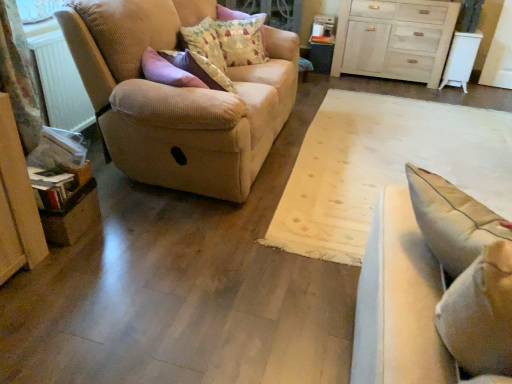
The width and height of the screenshot is (512, 384). Describe the element at coordinates (242, 40) in the screenshot. I see `patterned fabric pillow at upper center, marked as the first pillow in a back-to-front arrangement` at that location.

Locate an element on the screen. patterned fabric pillow at upper center, which is the 2th pillow in front-to-back order is located at coordinates (242, 40).

This screenshot has width=512, height=384. What do you see at coordinates (178, 97) in the screenshot?
I see `beige corduroy couch at left, placed as the first studio couch when sorted from back to front` at bounding box center [178, 97].

Identify the location of beige corduroy couch at left, placed as the first studio couch when sorted from back to front. This screenshot has height=384, width=512. (178, 97).

You are a GUI agent. You are given a task and a screenshot of the screen. Output one action in this format:
    pyautogui.click(x=<x>, y=<y>)
    Task: Click on the fluffy cotton pillow at upper center, arranged as the 1th pillow when viewed from the front
    
    Given the screenshot: What is the action you would take?
    pyautogui.click(x=204, y=42)

What do you see at coordinates (394, 39) in the screenshot? I see `white wood chest of drawers at upper right` at bounding box center [394, 39].

Find the location of a particular element. light beige fabric studio couch at right, the second studio couch in the left-to-right sequence is located at coordinates (433, 288).

What do you see at coordinates (433, 288) in the screenshot?
I see `light beige fabric studio couch at right, the second studio couch in the left-to-right sequence` at bounding box center [433, 288].

At what (x,y) coordinates should I click in order to perform the action: click on patterned fabric pillow at upper center, marked as the first pillow in a back-to-front arrangement. Please return your answer as a coordinate pair (x, y). Image resolution: width=512 pixels, height=384 pixels. Looking at the image, I should click on (242, 40).

Would you say white plastic radiator at left is a long distance from light beige fabric studio couch at right, which is counted as the first studio couch, starting from the right?

Yes, white plastic radiator at left is far from light beige fabric studio couch at right, which is counted as the first studio couch, starting from the right.

From the image's perspective, between white plastic radiator at left and light beige fabric studio couch at right, acting as the first studio couch starting from the front, who is located below?

light beige fabric studio couch at right, acting as the first studio couch starting from the front, appears lower in the image.

In the scene shown: Is the position of white plastic radiator at left more distant than that of light beige fabric studio couch at right, positioned as the 2th studio couch in back-to-front order?

Yes, the depth of white plastic radiator at left is greater than that of light beige fabric studio couch at right, positioned as the 2th studio couch in back-to-front order.

In terms of size, does white plastic radiator at left appear bigger or smaller than light beige fabric studio couch at right, acting as the first studio couch starting from the front?

white plastic radiator at left is smaller than light beige fabric studio couch at right, acting as the first studio couch starting from the front.

At what (x,y) coordinates should I click in order to perform the action: click on pillow on the right of the beige corduroy couch at left, which appears as the first studio couch when viewed from the left. Please return your answer as a coordinate pair (x, y). Image resolution: width=512 pixels, height=384 pixels. Looking at the image, I should click on (242, 40).

Considering the sizes of beige corduroy couch at left, which is the second studio couch in front-to-back order, and patterned fabric pillow at upper center, which is the 2th pillow in front-to-back order, in the image, is beige corduroy couch at left, which is the second studio couch in front-to-back order, wider or thinner than patterned fabric pillow at upper center, which is the 2th pillow in front-to-back order,?

Clearly, beige corduroy couch at left, which is the second studio couch in front-to-back order, has more width compared to patterned fabric pillow at upper center, which is the 2th pillow in front-to-back order.

Is beige corduroy couch at left, placed as the second studio couch when sorted from right to left, outside of patterned fabric pillow at upper center, which is the 2th pillow in front-to-back order?

That's correct, beige corduroy couch at left, placed as the second studio couch when sorted from right to left, is outside of patterned fabric pillow at upper center, which is the 2th pillow in front-to-back order.

Is beige corduroy couch at left, which appears as the first studio couch when viewed from the left, oriented towards patterned fabric pillow at upper center, which is the 2th pillow in front-to-back order?

Yes, beige corduroy couch at left, which appears as the first studio couch when viewed from the left, is aimed at patterned fabric pillow at upper center, which is the 2th pillow in front-to-back order.

Can you tell me how much fluffy cotton pillow at upper center, placed as the 2th pillow when sorted from back to front, and white wood chest of drawers at upper right differ in facing direction?

There is a 94.4-degree angle between the facing directions of fluffy cotton pillow at upper center, placed as the 2th pillow when sorted from back to front, and white wood chest of drawers at upper right.

From a real-world perspective, is fluffy cotton pillow at upper center, placed as the 2th pillow when sorted from back to front, positioned above or below white wood chest of drawers at upper right?

fluffy cotton pillow at upper center, placed as the 2th pillow when sorted from back to front, is above white wood chest of drawers at upper right.

Between fluffy cotton pillow at upper center, placed as the 2th pillow when sorted from back to front, and white wood chest of drawers at upper right, which one is positioned in front?

Positioned in front is fluffy cotton pillow at upper center, placed as the 2th pillow when sorted from back to front.

Is fluffy cotton pillow at upper center, arranged as the 1th pillow when viewed from the front, to the right of white wood chest of drawers at upper right from the viewer's perspective?

No, fluffy cotton pillow at upper center, arranged as the 1th pillow when viewed from the front, is not to the right of white wood chest of drawers at upper right.

In terms of width, does beige corduroy couch at left, which is the second studio couch in front-to-back order, look wider or thinner when compared to fluffy cotton pillow at upper center, placed as the 2th pillow when sorted from back to front?

In the image, beige corduroy couch at left, which is the second studio couch in front-to-back order, appears to be wider than fluffy cotton pillow at upper center, placed as the 2th pillow when sorted from back to front.

Does beige corduroy couch at left, placed as the first studio couch when sorted from back to front, touch fluffy cotton pillow at upper center, placed as the 2th pillow when sorted from back to front?

No, beige corduroy couch at left, placed as the first studio couch when sorted from back to front, is not beside fluffy cotton pillow at upper center, placed as the 2th pillow when sorted from back to front.

Is point (170, 90) positioned after point (215, 44)?

No, it is in front of (215, 44).

Which object is more forward, light beige fabric studio couch at right, acting as the first studio couch starting from the front, or beige corduroy couch at left, which appears as the first studio couch when viewed from the left?

light beige fabric studio couch at right, acting as the first studio couch starting from the front.

Is light beige fabric studio couch at right, acting as the first studio couch starting from the front, positioned beyond the bounds of beige corduroy couch at left, which appears as the first studio couch when viewed from the left?

light beige fabric studio couch at right, acting as the first studio couch starting from the front, lies outside beige corduroy couch at left, which appears as the first studio couch when viewed from the left,'s area.

Who is taller, light beige fabric studio couch at right, which is counted as the first studio couch, starting from the right, or beige corduroy couch at left, placed as the second studio couch when sorted from right to left?

With more height is beige corduroy couch at left, placed as the second studio couch when sorted from right to left.

Measure the distance between light beige fabric studio couch at right, acting as the first studio couch starting from the front, and beige corduroy couch at left, placed as the second studio couch when sorted from right to left.

light beige fabric studio couch at right, acting as the first studio couch starting from the front, is 1.26 meters from beige corduroy couch at left, placed as the second studio couch when sorted from right to left.

Considering the relative sizes of white plastic radiator at left and patterned fabric pillow at upper center, which is the 2th pillow in front-to-back order, in the image provided, is white plastic radiator at left smaller than patterned fabric pillow at upper center, which is the 2th pillow in front-to-back order,?

Yes.

Locate an element on the screen. radiator below the patterned fabric pillow at upper center, marked as the first pillow in a back-to-front arrangement (from a real-world perspective) is located at coordinates (60, 83).

Considering the sizes of white plastic radiator at left and patterned fabric pillow at upper center, marked as the first pillow in a back-to-front arrangement, in the image, is white plastic radiator at left wider or thinner than patterned fabric pillow at upper center, marked as the first pillow in a back-to-front arrangement,?

Clearly, white plastic radiator at left has less width compared to patterned fabric pillow at upper center, marked as the first pillow in a back-to-front arrangement.

From the image's perspective, is white plastic radiator at left located above or below patterned fabric pillow at upper center, marked as the first pillow in a back-to-front arrangement?

From the image's perspective, white plastic radiator at left appears below patterned fabric pillow at upper center, marked as the first pillow in a back-to-front arrangement.

Do you think light beige fabric studio couch at right, positioned as the 2th studio couch in back-to-front order, is within white plastic radiator at left, or outside of it?

light beige fabric studio couch at right, positioned as the 2th studio couch in back-to-front order, is located beyond the bounds of white plastic radiator at left.

How much distance is there between light beige fabric studio couch at right, acting as the first studio couch starting from the front, and white plastic radiator at left?

light beige fabric studio couch at right, acting as the first studio couch starting from the front, is 6.48 feet away from white plastic radiator at left.

Consider the image. From the image's perspective, which one is positioned higher, light beige fabric studio couch at right, the second studio couch in the left-to-right sequence, or white plastic radiator at left?

white plastic radiator at left.

From the picture: From a real-world perspective, is light beige fabric studio couch at right, which is counted as the first studio couch, starting from the right, positioned under white plastic radiator at left based on gravity?

Yes, from a real-world perspective, light beige fabric studio couch at right, which is counted as the first studio couch, starting from the right, is below white plastic radiator at left.

You are a GUI agent. You are given a task and a screenshot of the screen. Output one action in this format:
    pyautogui.click(x=<x>, y=<y>)
    Task: Click on the 2nd studio couch in front of the white plastic radiator at left
    
    Given the screenshot: What is the action you would take?
    pyautogui.click(x=433, y=288)

Which pillow is the 2nd one when counting from the back of the beige corduroy couch at left, which is the second studio couch in front-to-back order? Please provide its 2D coordinates.

[(242, 40)]

When comparing their distances from patterned fabric pillow at upper center, marked as the first pillow in a back-to-front arrangement, does white wood chest of drawers at upper right or beige corduroy couch at left, which appears as the first studio couch when viewed from the left, seem closer?

beige corduroy couch at left, which appears as the first studio couch when viewed from the left, is closer to patterned fabric pillow at upper center, marked as the first pillow in a back-to-front arrangement.

Estimate the real-world distances between objects in this image. Which object is closer to fluffy cotton pillow at upper center, arranged as the 1th pillow when viewed from the front, patterned fabric pillow at upper center, marked as the first pillow in a back-to-front arrangement, or white wood chest of drawers at upper right?

patterned fabric pillow at upper center, marked as the first pillow in a back-to-front arrangement, is closer to fluffy cotton pillow at upper center, arranged as the 1th pillow when viewed from the front.

When comparing their distances from white wood chest of drawers at upper right, does beige corduroy couch at left, which is the second studio couch in front-to-back order, or light beige fabric studio couch at right, the second studio couch in the left-to-right sequence, seem closer?

The object closer to white wood chest of drawers at upper right is beige corduroy couch at left, which is the second studio couch in front-to-back order.

Which object lies nearer to the anchor point light beige fabric studio couch at right, acting as the first studio couch starting from the front, beige corduroy couch at left, placed as the second studio couch when sorted from right to left, or white plastic radiator at left?

The object closer to light beige fabric studio couch at right, acting as the first studio couch starting from the front, is beige corduroy couch at left, placed as the second studio couch when sorted from right to left.

Based on their spatial positions, is patterned fabric pillow at upper center, which is the 2th pillow in front-to-back order, or beige corduroy couch at left, placed as the second studio couch when sorted from right to left, further from white plastic radiator at left?

Based on the image, patterned fabric pillow at upper center, which is the 2th pillow in front-to-back order, appears to be further to white plastic radiator at left.

When comparing their distances from beige corduroy couch at left, placed as the second studio couch when sorted from right to left, does white plastic radiator at left or patterned fabric pillow at upper center, which is the 2th pillow in front-to-back order, seem further?

white plastic radiator at left is further to beige corduroy couch at left, placed as the second studio couch when sorted from right to left.

From the image, which object appears to be nearer to light beige fabric studio couch at right, acting as the first studio couch starting from the front, beige corduroy couch at left, which appears as the first studio couch when viewed from the left, or white wood chest of drawers at upper right?

beige corduroy couch at left, which appears as the first studio couch when viewed from the left, lies closer to light beige fabric studio couch at right, acting as the first studio couch starting from the front, than the other object.

Estimate the real-world distances between objects in this image. Which object is further from white wood chest of drawers at upper right, light beige fabric studio couch at right, positioned as the 2th studio couch in back-to-front order, or fluffy cotton pillow at upper center, arranged as the 1th pillow when viewed from the front?

The object further to white wood chest of drawers at upper right is light beige fabric studio couch at right, positioned as the 2th studio couch in back-to-front order.

I want to click on studio couch between light beige fabric studio couch at right, positioned as the 2th studio couch in back-to-front order, and patterned fabric pillow at upper center, marked as the first pillow in a back-to-front arrangement, along the z-axis, so click(178, 97).

This screenshot has width=512, height=384. In order to click on pillow between white plastic radiator at left and beige corduroy couch at left, which is the second studio couch in front-to-back order in this screenshot , I will do `click(204, 42)`.

What are the coordinates of `studio couch between light beige fabric studio couch at right, which is counted as the first studio couch, starting from the right, and white wood chest of drawers at upper right, along the z-axis` in the screenshot? It's located at (178, 97).

In order to click on radiator between light beige fabric studio couch at right, the second studio couch in the left-to-right sequence, and fluffy cotton pillow at upper center, placed as the 2th pillow when sorted from back to front, along the z-axis in this screenshot , I will do `click(60, 83)`.